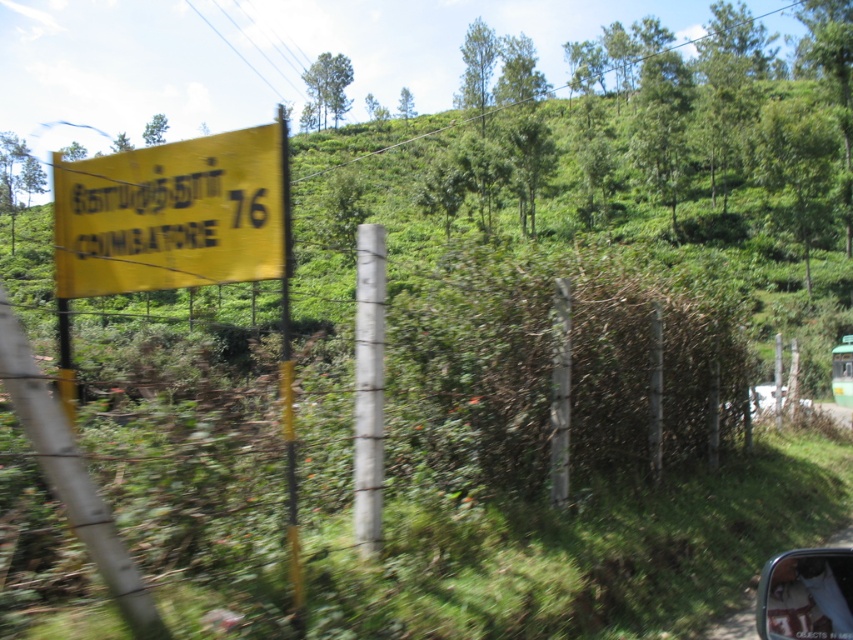
You are a driver approaching the yellow matte sign at left and the green matte car at right. Which object is closer to you as you look at the scene?

The yellow matte sign at left is closer to you because it is positioned over the green matte car at right, indicating it is in a more forward plane in the scene.

You are driving a car and see the yellow matte sign at left and the green matte car at right in your view. Which object is positioned more to the left side?

The yellow matte sign at left is positioned more to the left than the green matte car at right.